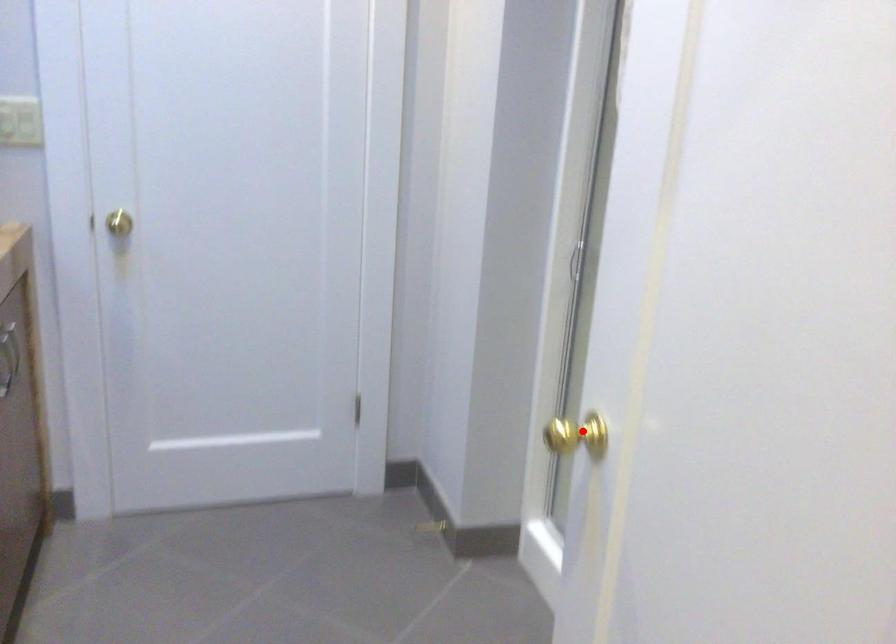
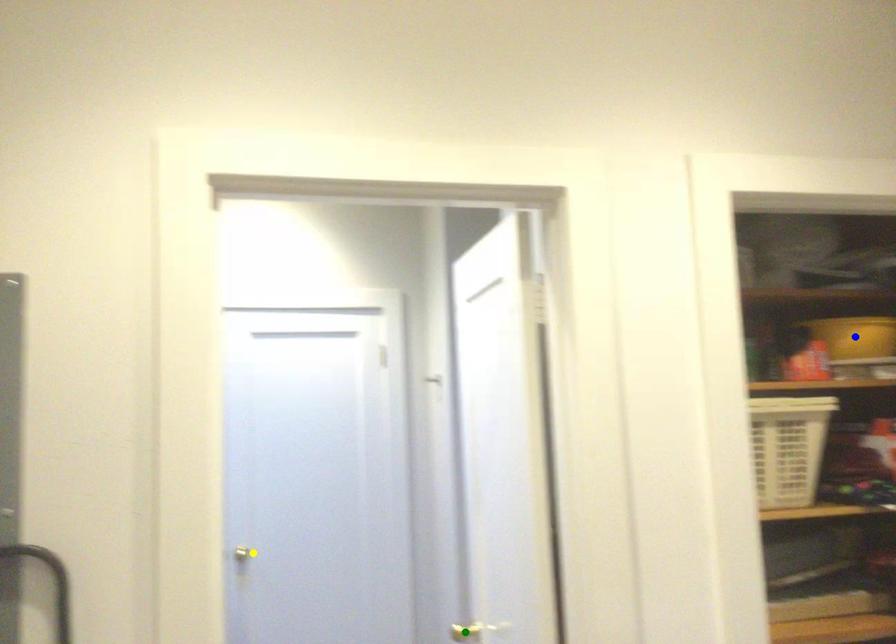
Question: I am providing you with two images of the same scene from different viewpoints. A red point is marked on the first image. You are given multiple points on the second image. In image 2, which mark is for the same physical point as the one in image 1?

Choices:
 (A) blue point
 (B) green point
 (C) yellow point

Answer: (B)